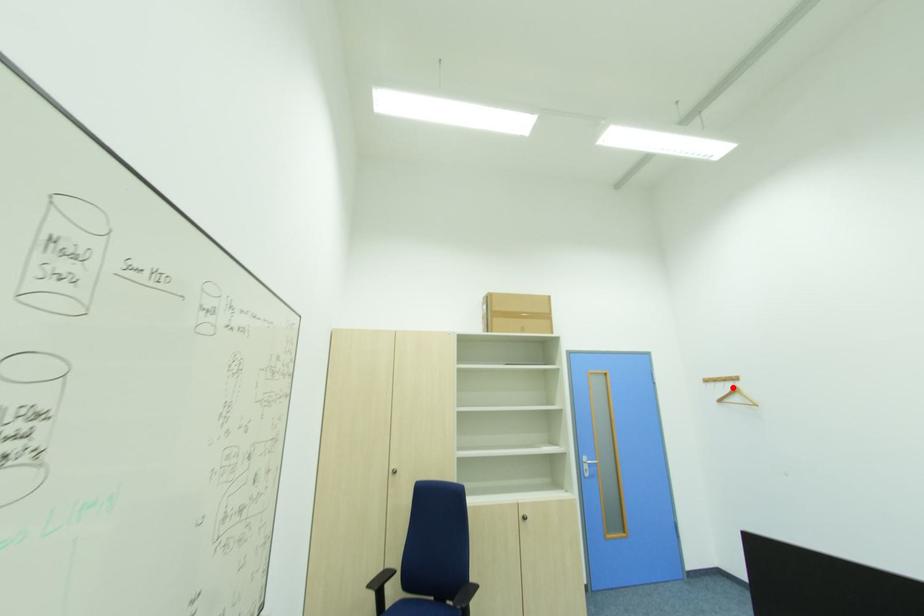
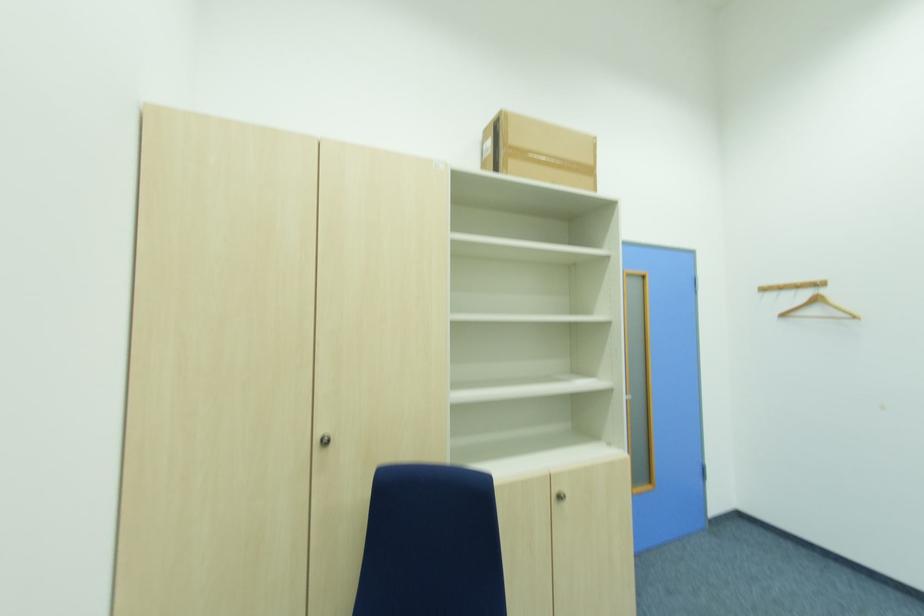
Locate, in the second image, the point that corresponds to the highlighted location in the first image.

(809, 296)